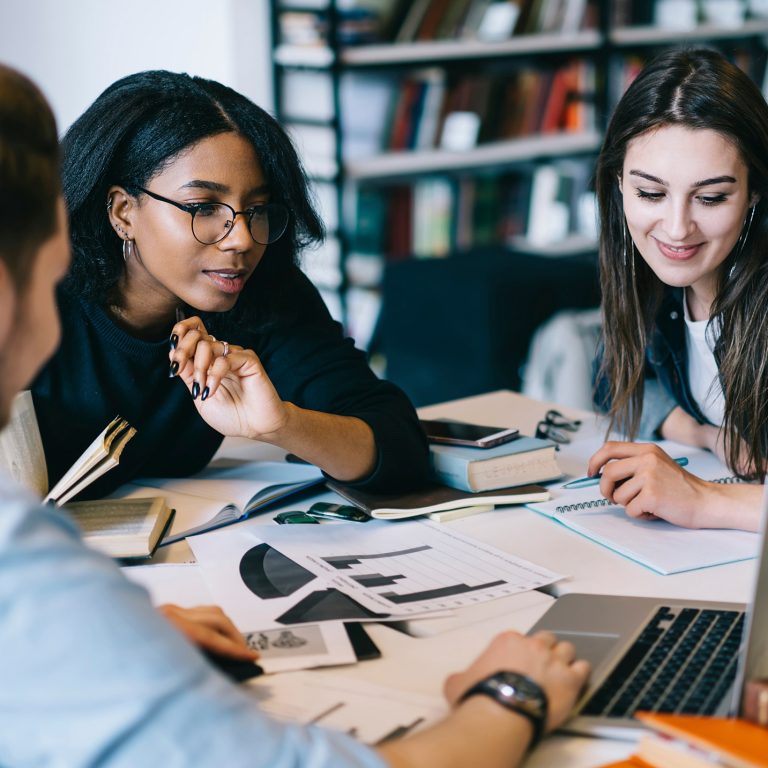
At what (x,y) coordinates should I click in order to perform the action: click on open book. Please return your answer as a coordinate pair (x, y). The width and height of the screenshot is (768, 768). Looking at the image, I should click on (128, 525).